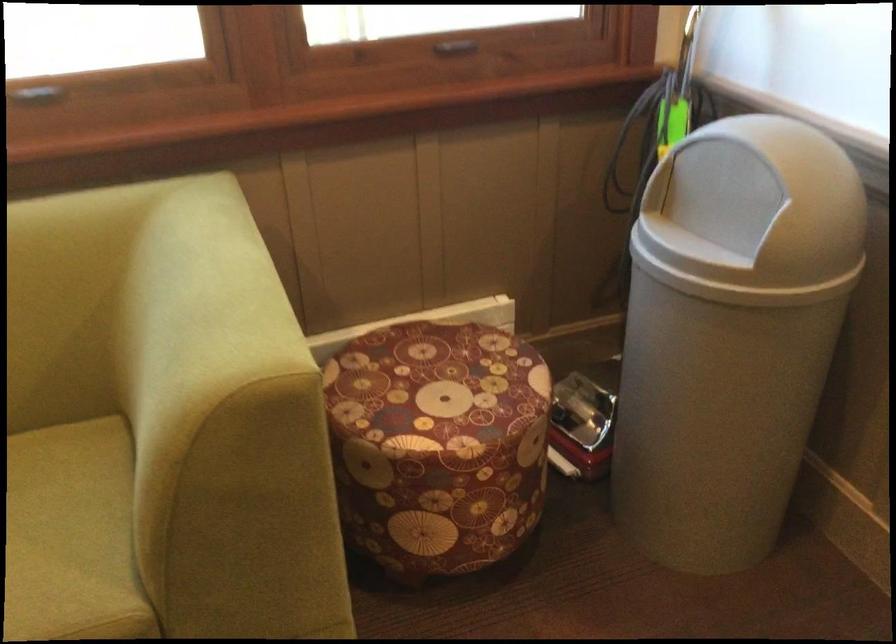
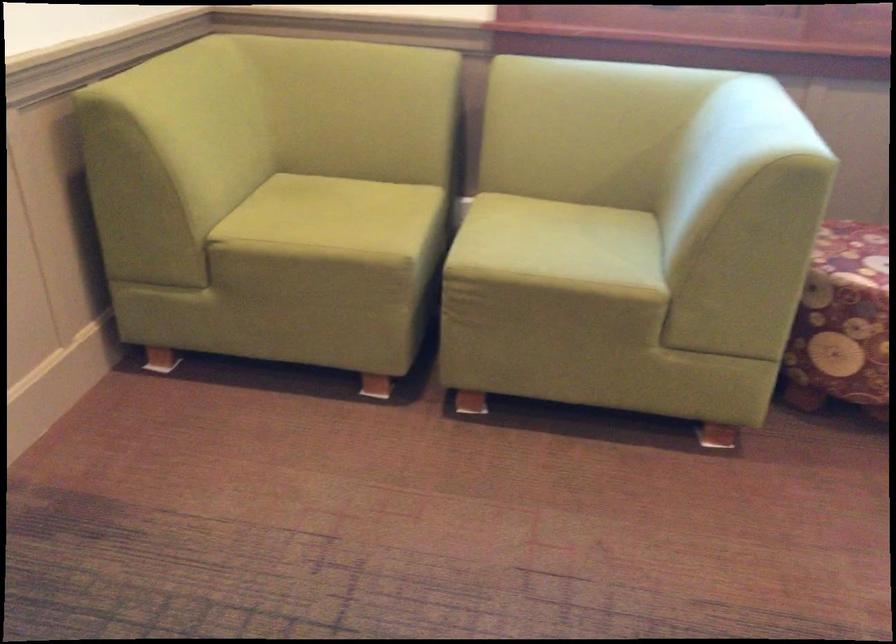
Question: How did the camera likely rotate?

Choices:
 (A) Left
 (B) Right
 (C) Up
 (D) Down

Answer: (A)